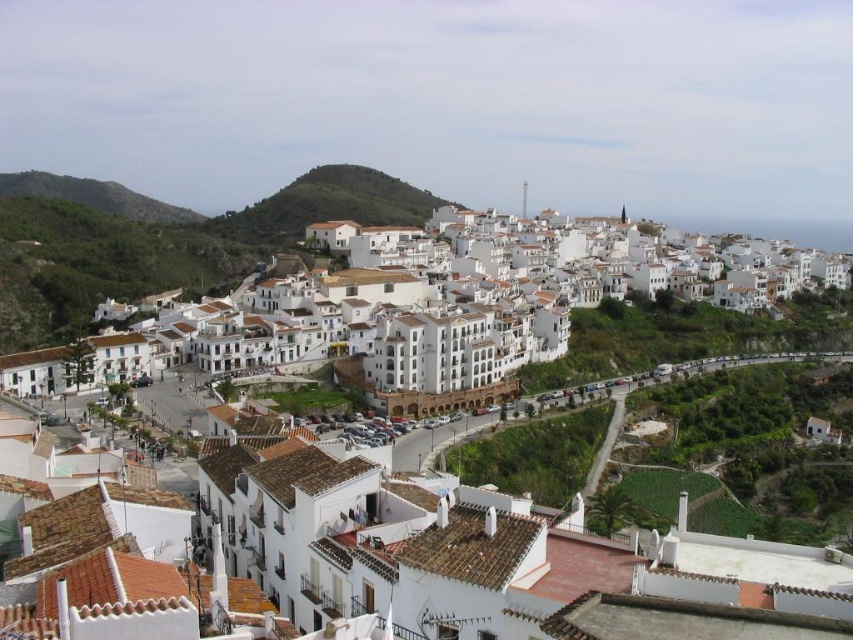
You are standing at the entrance of the town and want to reach the white matte building at center. Given the winding road and the hilly terrain, can you estimate the shortest path to the building?

The white matte building at center is located at point coordinates, but without specific terrain elevation data or road layout details, it is challenging to estimate the exact shortest path. However, following the winding road towards the building would be the most reliable route as it aligns with the town layout described.

You are a tour guide leading a group to a viewpoint overlooking the hillside town. You want to explain the spacing between the white matte building at center and the white stucco buildings at center. How far apart are they?

The distance between the white matte building at center and the white stucco buildings at center is 12.46 meters.